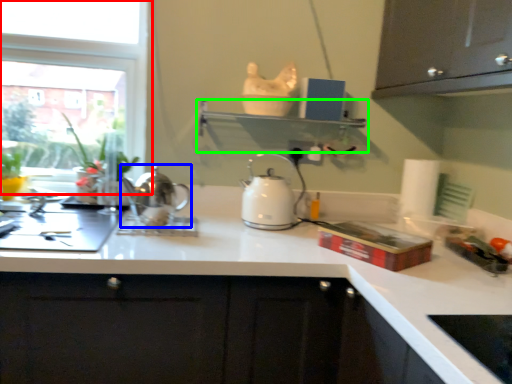
Question: Which object is positioned closest to window (highlighted by a red box)? Select from kettle (highlighted by a blue box) and shelf (highlighted by a green box).

Choices:
 (A) kettle
 (B) shelf

Answer: (A)